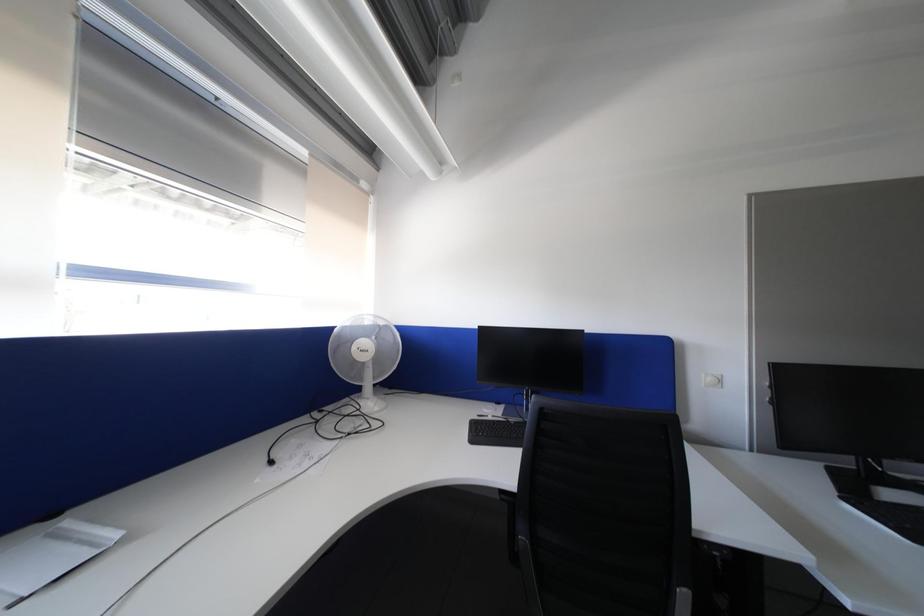
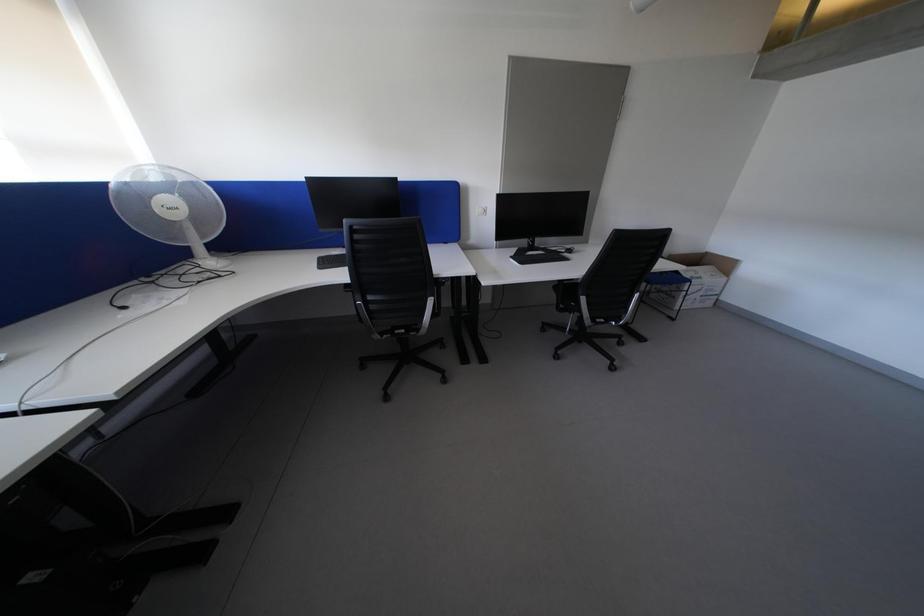
Based on the continuous images, in which direction is the camera rotating?

The camera's rotation is toward right-down.